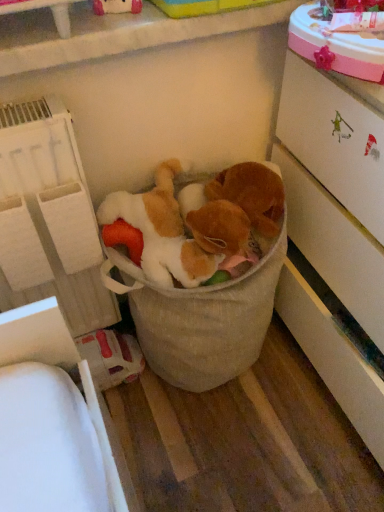
Question: Considering the relative sizes of white textured shelf at left and white glossy cabinet at right in the image provided, is white textured shelf at left thinner than white glossy cabinet at right?

Choices:
 (A) no
 (B) yes

Answer: (B)

Question: Considering the relative sizes of white textured shelf at left and white glossy cabinet at right in the image provided, is white textured shelf at left shorter than white glossy cabinet at right?

Choices:
 (A) no
 (B) yes

Answer: (B)

Question: Can you confirm if white textured shelf at left is taller than white glossy cabinet at right?

Choices:
 (A) no
 (B) yes

Answer: (A)

Question: Is white textured shelf at left touching white glossy cabinet at right?

Choices:
 (A) yes
 (B) no

Answer: (B)

Question: Does white textured shelf at left contain white glossy cabinet at right?

Choices:
 (A) yes
 (B) no

Answer: (B)

Question: From a real-world perspective, is white textured shelf at left below white glossy cabinet at right?

Choices:
 (A) yes
 (B) no

Answer: (B)

Question: Would you say white glossy cabinet at right is a long distance from fluffy beige stuffed animals at center?

Choices:
 (A) yes
 (B) no

Answer: (B)

Question: Is white glossy cabinet at right looking in the opposite direction of fluffy beige stuffed animals at center?

Choices:
 (A) no
 (B) yes

Answer: (A)

Question: Is white glossy cabinet at right positioned behind fluffy beige stuffed animals at center?

Choices:
 (A) yes
 (B) no

Answer: (B)

Question: Can you confirm if white glossy cabinet at right is thinner than fluffy beige stuffed animals at center?

Choices:
 (A) yes
 (B) no

Answer: (B)

Question: Does white glossy cabinet at right have a greater height compared to fluffy beige stuffed animals at center?

Choices:
 (A) no
 (B) yes

Answer: (B)

Question: Is white glossy cabinet at right closer to camera compared to fluffy beige stuffed animals at center?

Choices:
 (A) yes
 (B) no

Answer: (A)

Question: From the image's perspective, is fluffy beige stuffed animals at center under white glossy cabinet at right?

Choices:
 (A) yes
 (B) no

Answer: (A)